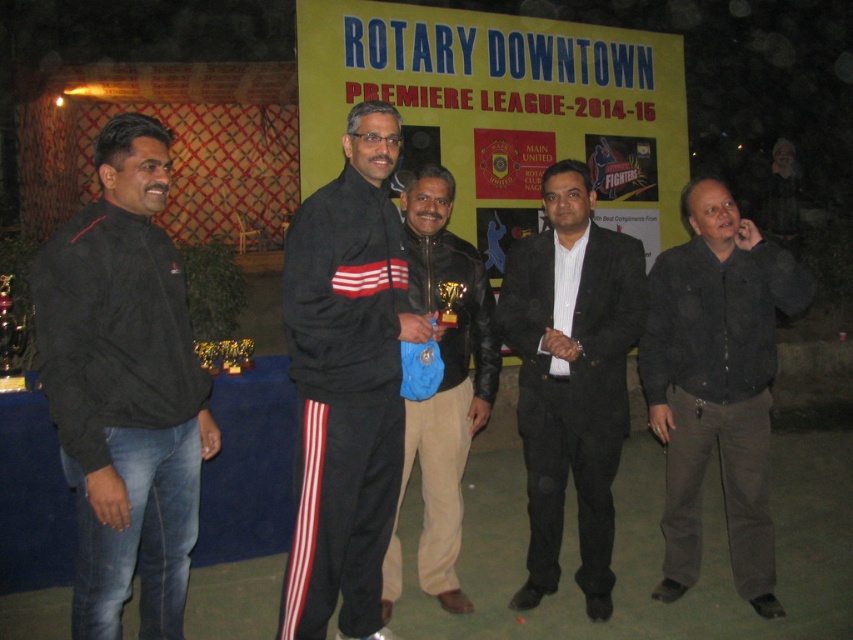
You are a photographer standing at the back of the group. You want to take a photo that includes both the dark gray shirt at right and the brown leather jacket at center. Given that your camera has a maximum focus range of 30 inches, will you be able to capture both subjects in focus without moving closer?

The distance between the dark gray shirt at right and the brown leather jacket at center is 35.57 inches, which exceeds the camera maximum focus range of 30 inches. Therefore, you won

Consider the image. You are a photographer at the event and need to capture a photo where both the black track suit at center and the brown leather jacket at center are clearly visible. Based on their positions, which clothing item is covering part of the other?

The black track suit at center is positioned over the brown leather jacket at center, so it is covering part of it.

In the scene shown: You are a photographer at the event and need to capture a photo where both the black track suit at center and the brown leather jacket at center are visible. Considering their heights, which one might you position closer to the front to ensure both are fully visible in the frame?

The black track suit at center is taller than the brown leather jacket at center. To ensure both are fully visible, position the brown leather jacket at center closer to the front so the taller black track suit at center doesn